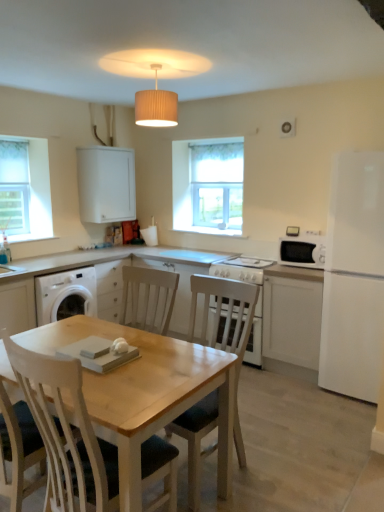
I want to click on white matte refrigerator at right, so click(x=354, y=278).

The height and width of the screenshot is (512, 384). What do you see at coordinates (14, 187) in the screenshot? I see `white fabric window screen at left` at bounding box center [14, 187].

I want to click on light wood chair at center, so click(226, 327).

What do you see at coordinates (241, 269) in the screenshot? The width and height of the screenshot is (384, 512). I see `white glossy stove at center` at bounding box center [241, 269].

Image resolution: width=384 pixels, height=512 pixels. Describe the element at coordinates (292, 316) in the screenshot. I see `white matte cabinet at right, which is the second cabinetry from top to bottom` at that location.

The image size is (384, 512). I want to click on white matte cabinet at upper left, the 1th cabinetry in the top-to-bottom sequence, so click(106, 184).

What is the approximate width of white matte cabinet at upper left, which is counted as the second cabinetry, starting from the bottom?

The width of white matte cabinet at upper left, which is counted as the second cabinetry, starting from the bottom, is 13.54 inches.

Locate an element on the screen. white matte refrigerator at right is located at coordinates (354, 278).

In the image, is light wood chair at center positioned in front of or behind white matte refrigerator at right?

light wood chair at center is positioned closer to the viewer than white matte refrigerator at right.

Is light wood chair at center to the right of white matte refrigerator at right from the viewer's perspective?

No, light wood chair at center is not to the right of white matte refrigerator at right.

From the image's perspective, which one is positioned lower, light wood chair at center or white matte refrigerator at right?

From the image's view, light wood chair at center is below.

Can you tell me how much beige pleated shade at upper center and white glossy microwave oven at right differ in facing direction?

There is a 2.46-degree angle between the facing directions of beige pleated shade at upper center and white glossy microwave oven at right.

From a real-world perspective, is beige pleated shade at upper center physically below white glossy microwave oven at right?

No.

Would you say beige pleated shade at upper center contains white glossy microwave oven at right?

No.

Between point (241, 215) and point (340, 277), which one is positioned in front?

Positioned in front is point (340, 277).

Can you confirm if white glass window at center is smaller than white matte refrigerator at right?

Yes, white glass window at center is smaller than white matte refrigerator at right.

Consider the image. Considering the positions of objects white glass window at center and white matte refrigerator at right in the image provided, who is more to the left, white glass window at center or white matte refrigerator at right?

From the viewer's perspective, white glass window at center appears more on the left side.

In the scene shown: From a real-world perspective, which object stands above the other?

white glass window at center is physically above.

What's the angular difference between white matte cabinet at right, positioned as the second cabinetry in left-to-right order, and white matte refrigerator at right's facing directions?

There is a 0.66-degree angle between the facing directions of white matte cabinet at right, positioned as the second cabinetry in left-to-right order, and white matte refrigerator at right.

From their relative heights in the image, would you say white matte cabinet at right, which is the first cabinetry from bottom to top, is taller or shorter than white matte refrigerator at right?

white matte cabinet at right, which is the first cabinetry from bottom to top, is shorter than white matte refrigerator at right.

Is white matte cabinet at right, the 1th cabinetry from the front, beside white matte refrigerator at right?

No, white matte cabinet at right, the 1th cabinetry from the front, is not making contact with white matte refrigerator at right.

How far apart are white matte cabinet at right, which is the second cabinetry from top to bottom, and white matte refrigerator at right?

The distance of white matte cabinet at right, which is the second cabinetry from top to bottom, from white matte refrigerator at right is 14.50 inches.

From the image's perspective, between beige pleated shade at upper center and white matte cabinet at right, positioned as the second cabinetry in left-to-right order, who is located below?

white matte cabinet at right, positioned as the second cabinetry in left-to-right order.

Which is nearer, (142, 99) or (314, 287)?

Point (142, 99) is closer to the camera than point (314, 287).

Where is `cabinetry on the right of beige pleated shade at upper center`? cabinetry on the right of beige pleated shade at upper center is located at coordinates (292, 316).

Is beige pleated shade at upper center touching white matte cabinet at right, marked as the 2th cabinetry in a back-to-front arrangement?

beige pleated shade at upper center is not next to white matte cabinet at right, marked as the 2th cabinetry in a back-to-front arrangement, and they're not touching.

Which is more to the left, white glossy stove at center or light wood chair at center?

light wood chair at center.

Is white glossy stove at center in front of or behind light wood chair at center in the image?

Visually, white glossy stove at center is located behind light wood chair at center.

Is white glossy stove at center not near light wood chair at center?

No.

Which of these two, white glossy stove at center or light wood chair at center, stands shorter?

white glossy stove at center is shorter.

Which is in front, white glossy stove at center or beige pleated shade at upper center?

beige pleated shade at upper center is more forward.

What's the angular difference between white glossy stove at center and beige pleated shade at upper center's facing directions?

They differ by 0.000363 degrees in their facing directions.

Would you say white glossy stove at center is to the left or to the right of beige pleated shade at upper center in the picture?

Clearly, white glossy stove at center is on the right of beige pleated shade at upper center in the image.

Is white glossy stove at center located outside beige pleated shade at upper center?

That's correct, white glossy stove at center is outside of beige pleated shade at upper center.

Find the location of `fridge above the light wood chair at center (from a real-world perspective)`. fridge above the light wood chair at center (from a real-world perspective) is located at coordinates (354, 278).

At what (x,y) coordinates should I click in order to perform the action: click on microwave oven below the beige pleated shade at upper center (from a real-world perspective). Please return your answer as a coordinate pair (x, y). Looking at the image, I should click on (302, 251).

Looking at the image, which one is located closer to white fabric window screen at left, beige pleated shade at upper center or white glass window at center?

white glass window at center is positioned closer to the anchor white fabric window screen at left.

From the image, which object appears to be farther from light wood chair at center, white matte cabinet at upper left, which appears as the 2th cabinetry when viewed from the right, or beige pleated shade at upper center?

The object further to light wood chair at center is white matte cabinet at upper left, which appears as the 2th cabinetry when viewed from the right.

From the image, which object appears to be farther from white matte cabinet at right, which is the second cabinetry from top to bottom, white fabric window screen at left or beige pleated shade at upper center?

Among the two, white fabric window screen at left is located further to white matte cabinet at right, which is the second cabinetry from top to bottom.

Which object lies further to the anchor point white fabric window screen at left, white matte cabinet at upper left, placed as the 1th cabinetry when sorted from back to front, or white matte cabinet at right, which is the second cabinetry from top to bottom?

Based on the image, white matte cabinet at right, which is the second cabinetry from top to bottom, appears to be further to white fabric window screen at left.

Based on their spatial positions, is white matte cabinet at right, positioned as the 1th cabinetry in right-to-left order, or white glossy microwave oven at right closer to white glossy stove at center?

white glossy microwave oven at right.

Based on their spatial positions, is light wood chair at center or white glossy stove at center closer to white glass window at center?

white glossy stove at center lies closer to white glass window at center than the other object.

When comparing their distances from white glossy stove at center, does light wood chair at center or white matte refrigerator at right seem further?

Based on the image, white matte refrigerator at right appears to be further to white glossy stove at center.

Estimate the real-world distances between objects in this image. Which object is closer to beige pleated shade at upper center, white matte refrigerator at right or white glossy microwave oven at right?

white glossy microwave oven at right.

Find the location of a particular element. Image resolution: width=384 pixels, height=512 pixels. lamp located between white matte cabinet at upper left, acting as the 1th cabinetry starting from the left, and white matte cabinet at right, which is the second cabinetry from top to bottom, in the left-right direction is located at coordinates (156, 105).

I want to click on window screen located between light wood chair at center and white matte cabinet at upper left, acting as the 1th cabinetry starting from the left, in the depth direction, so click(x=14, y=187).

Where is `stove between white matte cabinet at upper left, placed as the 1th cabinetry when sorted from back to front, and white matte cabinet at right, which is the second cabinetry from top to bottom, in the horizontal direction`? stove between white matte cabinet at upper left, placed as the 1th cabinetry when sorted from back to front, and white matte cabinet at right, which is the second cabinetry from top to bottom, in the horizontal direction is located at coordinates (241, 269).

Find the location of a particular element. This screenshot has width=384, height=512. stove between beige pleated shade at upper center and white glass window at center in the front-back direction is located at coordinates (241, 269).